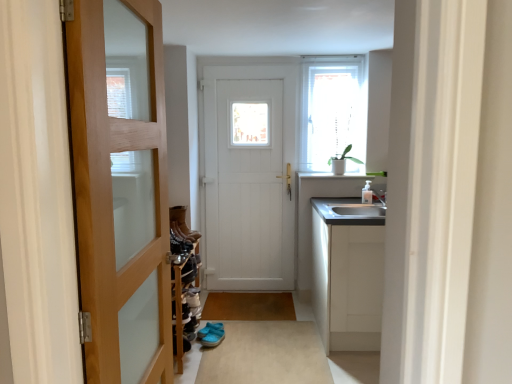
Image resolution: width=512 pixels, height=384 pixels. I want to click on vacant area situated below brown matte mat at center, the second plain ordered from the bottom (from a real-world perspective), so click(255, 300).